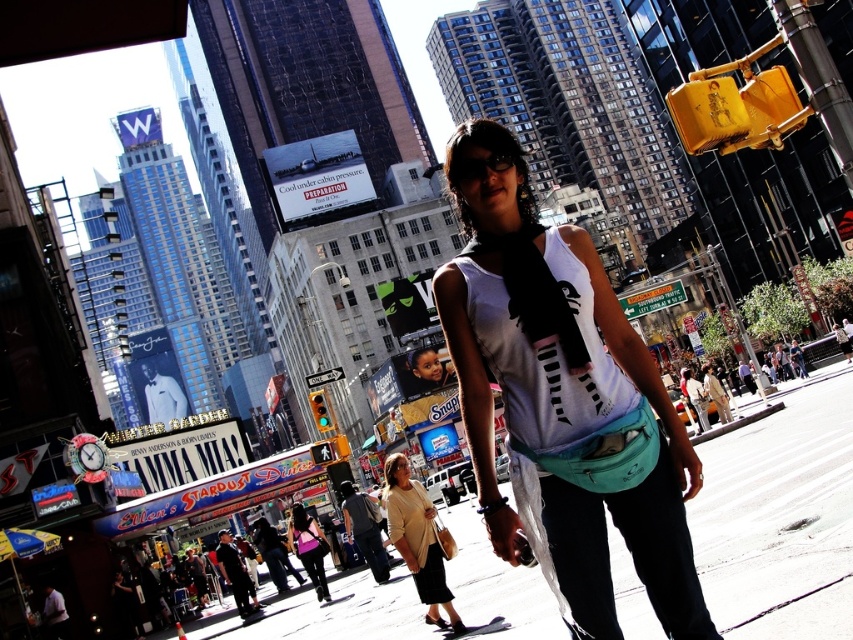
Question: Can you confirm if dark gray cotton shirt at lower center is positioned above dark blue jeans at lower center?

Choices:
 (A) yes
 (B) no

Answer: (A)

Question: Which point is farther from the camera taking this photo?

Choices:
 (A) (238, 604)
 (B) (351, 516)

Answer: (A)

Question: Where is beige fabric purse at center located in relation to dark gray cotton shirt at lower center in the image?

Choices:
 (A) above
 (B) below

Answer: (A)

Question: Which point appears closest to the camera in this image?

Choices:
 (A) (300, 508)
 (B) (416, 502)
 (C) (376, 572)

Answer: (B)

Question: Which is nearer to the smooth asphalt at lower center?

Choices:
 (A) dark blue jeans at lower center
 (B) dark gray cotton shirt at lower center
 (C) matte black scarf at center
 (D) pink fabric purse at lower left

Answer: (B)

Question: Where is smooth asphalt at lower center located in relation to matte black tank top at center in the image?

Choices:
 (A) below
 (B) above

Answer: (A)